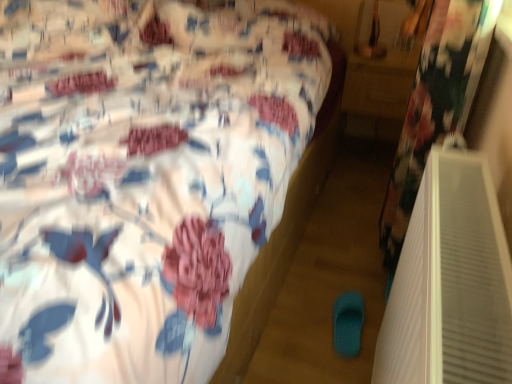
The image size is (512, 384). What are the coordinates of `empty space that is ontop of wooden table at right (from a real-world perspective)` in the screenshot? It's located at (379, 54).